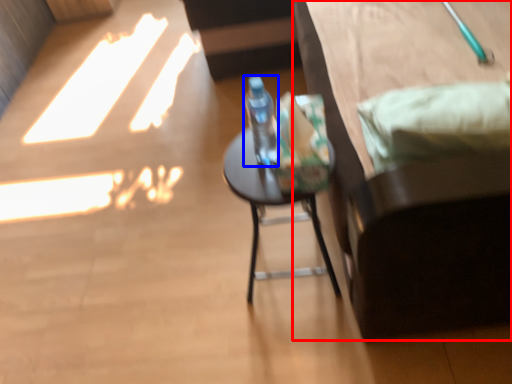
Question: Which object appears closest to the camera in this image, furniture (highlighted by a red box) or bottle (highlighted by a blue box)?

Choices:
 (A) furniture
 (B) bottle

Answer: (A)